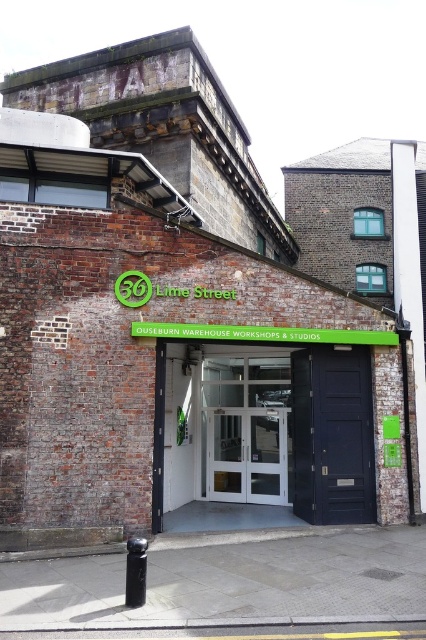
Question: Is white glass door at center above black polished metal pole at lower center?

Choices:
 (A) no
 (B) yes

Answer: (B)

Question: Which of the following is the farthest from the observer?

Choices:
 (A) (201, 440)
 (B) (135, 579)

Answer: (A)

Question: Which object is farther from the camera taking this photo?

Choices:
 (A) black polished metal pole at lower center
 (B) white glass door at center

Answer: (B)

Question: Does white glass door at center have a larger size compared to black polished metal pole at lower center?

Choices:
 (A) yes
 (B) no

Answer: (A)

Question: Where is white glass door at center located in relation to black polished metal pole at lower center in the image?

Choices:
 (A) below
 (B) above

Answer: (B)